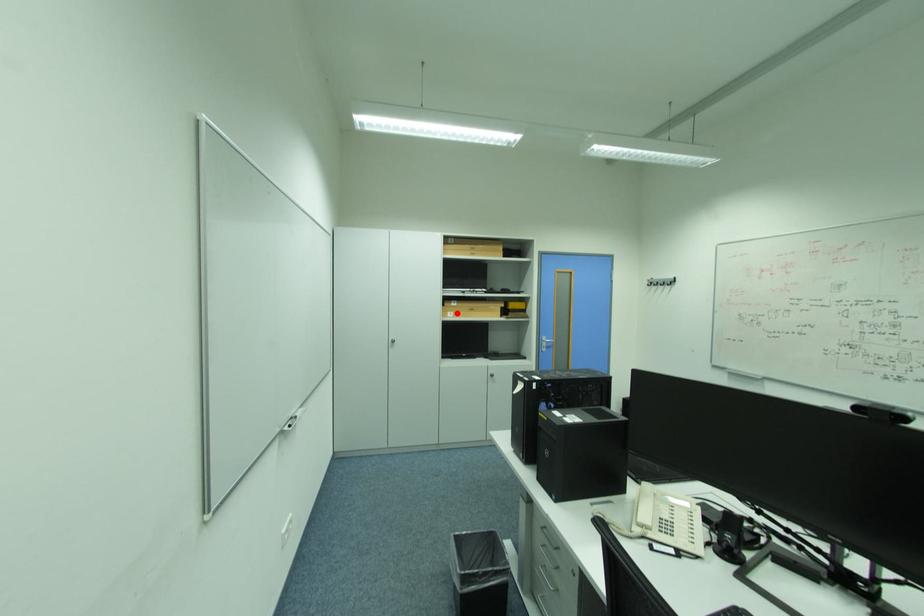
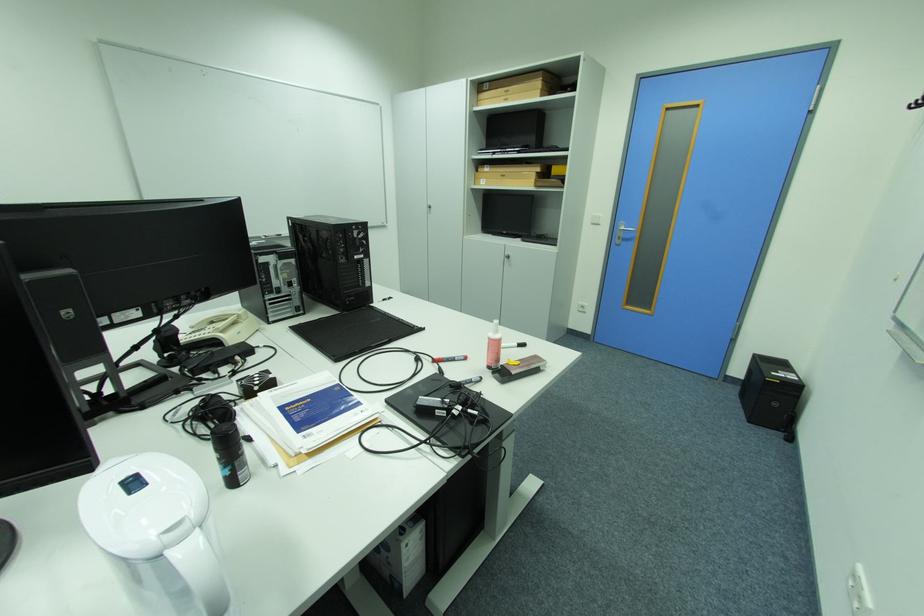
Where in the second image is the point corresponding to the highlighted location from the first image?

(490, 180)